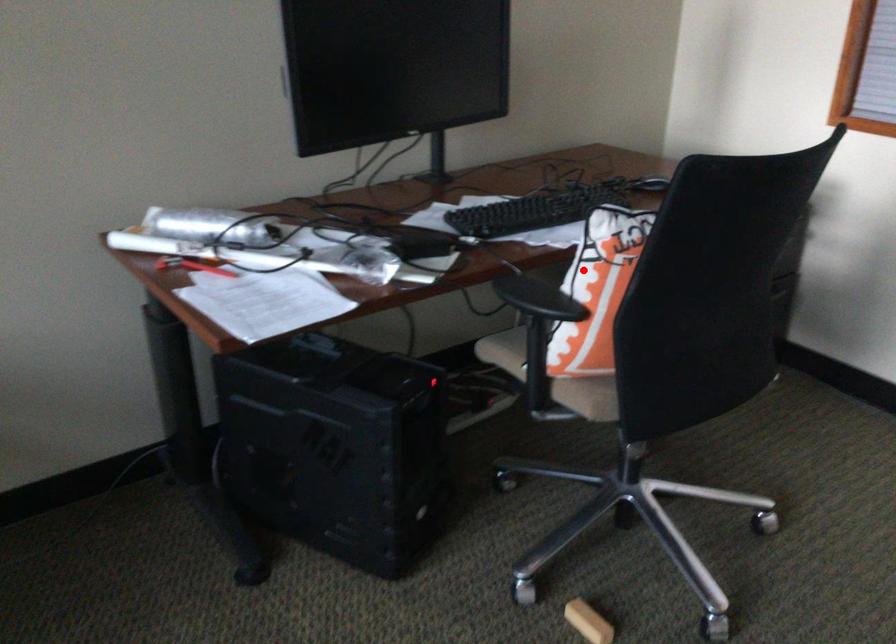
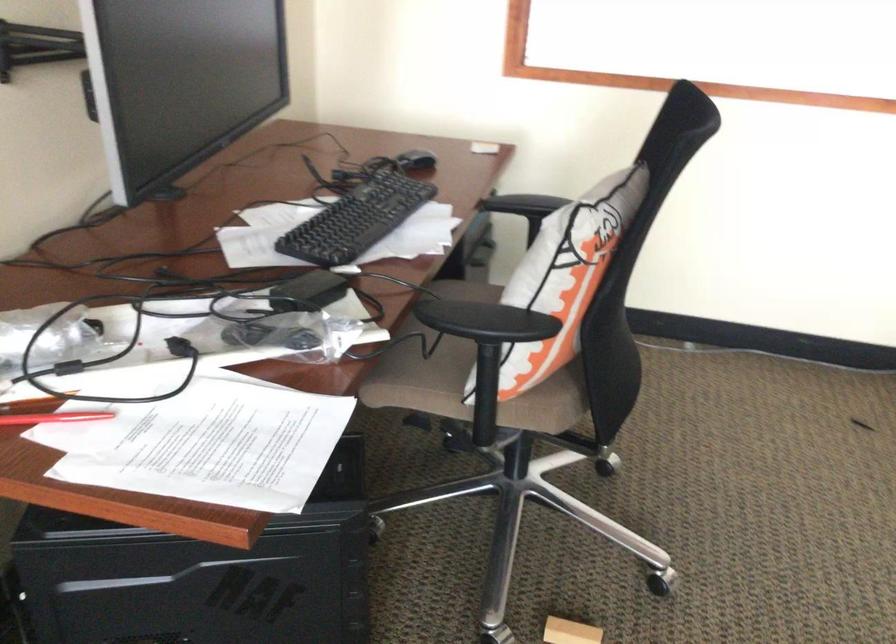
In the second image, find the point that corresponds to the highlighted location in the first image.

(564, 277)